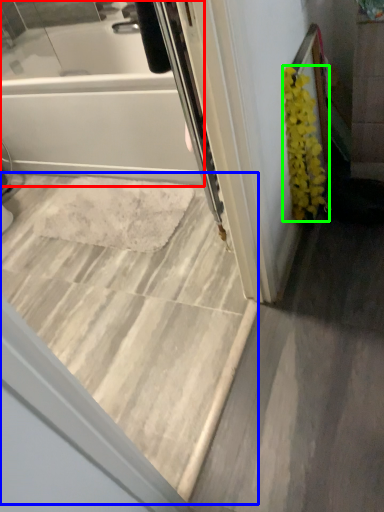
Question: Considering the real-world distances, which object is farthest from bathtub (highlighted by a red box)? stairwell (highlighted by a blue box) or flower (highlighted by a green box)?

Choices:
 (A) stairwell
 (B) flower

Answer: (B)